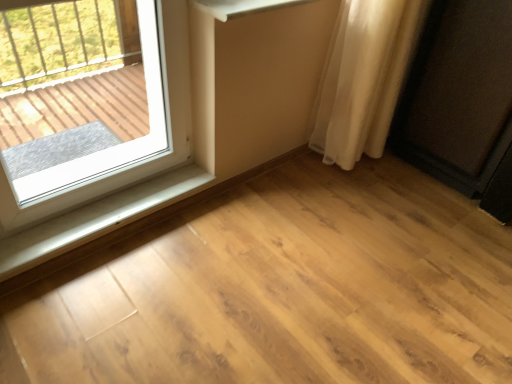
This screenshot has width=512, height=384. What do you see at coordinates (89, 101) in the screenshot?
I see `white plastic window at upper left` at bounding box center [89, 101].

What are the coordinates of `white plastic window at upper left` in the screenshot? It's located at (89, 101).

I want to click on white plastic window at upper left, so click(x=89, y=101).

Is white sheer curtain at right positioned beyond the bounds of white plastic window at upper left?

Indeed, white sheer curtain at right is completely outside white plastic window at upper left.

Which object is more forward, white sheer curtain at right or white plastic window at upper left?

white plastic window at upper left is more forward.

From a real-world perspective, is white sheer curtain at right on top of white plastic window at upper left?

No, from a real-world perspective, white sheer curtain at right is not above white plastic window at upper left.

Considering the positions of objects matte black speaker at right and white sheer curtain at right in the image provided, who is in front, matte black speaker at right or white sheer curtain at right?

matte black speaker at right is in front.

This screenshot has width=512, height=384. In order to click on screen door below the white sheer curtain at right (from the image's perspective) in this screenshot , I will do `click(458, 95)`.

From a real-world perspective, is matte black speaker at right on white sheer curtain at right?

No.

How much distance is there between matte black speaker at right and white sheer curtain at right?

12.01 inches.

Locate an element on the screen. screen door that is on the right side of white plastic window sill at lower left is located at coordinates (458, 95).

Are matte black speaker at right and white plastic window sill at lower left beside each other?

No, matte black speaker at right is not next to white plastic window sill at lower left.

Is matte black speaker at right to the left or to the right of white plastic window sill at lower left in the image?

matte black speaker at right is to the right of white plastic window sill at lower left.

From the picture: From a real-world perspective, is matte black speaker at right over white plastic window sill at lower left?

Yes.

Can you see white sheer curtain at right touching white plastic window sill at lower left?

There is a gap between white sheer curtain at right and white plastic window sill at lower left.

Can you tell me how much white sheer curtain at right and white plastic window sill at lower left differ in facing direction?

The angle between the facing direction of white sheer curtain at right and the facing direction of white plastic window sill at lower left is 1.36 degrees.

Which of these two, white sheer curtain at right or white plastic window sill at lower left, stands taller?

With more height is white sheer curtain at right.

Which is nearer, [318,97] or [144,196]?

Clearly, point [318,97] is more distant from the camera than point [144,196].

From a real-world perspective, relative to white plastic window sill at lower left, is white plastic window at upper left vertically above or below?

white plastic window at upper left is situated higher than white plastic window sill at lower left in the real world.

Measure the distance from white plastic window at upper left to white plastic window sill at lower left.

25.88 inches.

Between white plastic window at upper left and white plastic window sill at lower left, which one appears on the left side from the viewer's perspective?

white plastic window sill at lower left is more to the left.

Is white plastic window at upper left not inside white plastic window sill at lower left?

Yes, white plastic window at upper left is located beyond the bounds of white plastic window sill at lower left.

Is white plastic window at upper left wider than white sheer curtain at right?

Incorrect, the width of white plastic window at upper left does not surpass that of white sheer curtain at right.

Which of these two, white plastic window at upper left or white sheer curtain at right, is smaller?

white plastic window at upper left is smaller.

Which is more to the left, white plastic window at upper left or white sheer curtain at right?

white plastic window at upper left is more to the left.

From the image's perspective, between white plastic window at upper left and white sheer curtain at right, which one is located above?

From the image's view, white sheer curtain at right is above.

Which is less distant, (64, 216) or (340, 149)?

Point (64, 216) appears to be closer to the viewer than point (340, 149).

Which is more to the right, white plastic window sill at lower left or white sheer curtain at right?

Positioned to the right is white sheer curtain at right.

In the scene shown: What's the angular difference between white plastic window sill at lower left and white sheer curtain at right's facing directions?

1.36 degrees.

Find the location of `window sill that appears on the left of white sheer curtain at right`. window sill that appears on the left of white sheer curtain at right is located at coordinates (98, 219).

This screenshot has height=384, width=512. In order to click on curtain below the white plastic window at upper left (from a real-world perspective) in this screenshot , I will do `click(364, 77)`.

The image size is (512, 384). Find the location of `curtain on the left of matte black speaker at right`. curtain on the left of matte black speaker at right is located at coordinates (364, 77).

Which object lies further to the anchor point matte black speaker at right, white sheer curtain at right or white plastic window at upper left?

Based on the image, white plastic window at upper left appears to be further to matte black speaker at right.

Based on their spatial positions, is white sheer curtain at right or white plastic window sill at lower left closer to white plastic window at upper left?

white plastic window sill at lower left is closer to white plastic window at upper left.

Based on their spatial positions, is white plastic window at upper left or white plastic window sill at lower left closer to matte black speaker at right?

white plastic window sill at lower left is closer to matte black speaker at right.

Which object lies nearer to the anchor point matte black speaker at right, white plastic window sill at lower left or white plastic window at upper left?

Based on the image, white plastic window sill at lower left appears to be nearer to matte black speaker at right.

From the image, which object appears to be nearer to matte black speaker at right, white plastic window sill at lower left or white sheer curtain at right?

Among the two, white sheer curtain at right is located nearer to matte black speaker at right.

Estimate the real-world distances between objects in this image. Which object is further from matte black speaker at right, white sheer curtain at right or white plastic window sill at lower left?

Based on the image, white plastic window sill at lower left appears to be further to matte black speaker at right.

Which object lies nearer to the anchor point white plastic window at upper left, white plastic window sill at lower left or white sheer curtain at right?

Among the two, white plastic window sill at lower left is located nearer to white plastic window at upper left.

Based on the photo, based on their spatial positions, is white plastic window at upper left or white plastic window sill at lower left further from white sheer curtain at right?

white plastic window at upper left.

I want to click on curtain between white plastic window sill at lower left and matte black speaker at right in the horizontal direction, so click(364, 77).

You are a GUI agent. You are given a task and a screenshot of the screen. Output one action in this format:
    pyautogui.click(x=<x>, y=<y>)
    Task: Click on the window between white plastic window sill at lower left and white sheer curtain at right in the horizontal direction
    Image resolution: width=512 pixels, height=384 pixels.
    Given the screenshot: What is the action you would take?
    pyautogui.click(x=89, y=101)

Image resolution: width=512 pixels, height=384 pixels. I want to click on curtain between white plastic window at upper left and matte black speaker at right in the horizontal direction, so click(364, 77).

Identify the location of window situated between white plastic window sill at lower left and matte black speaker at right from left to right. [x=89, y=101].